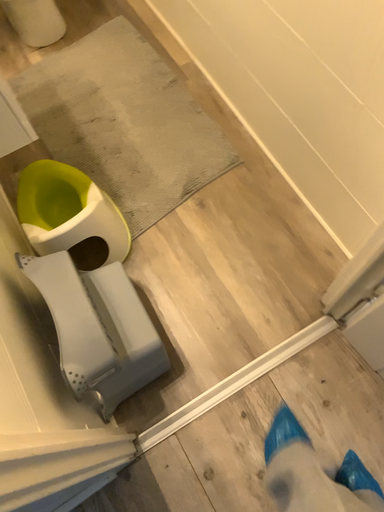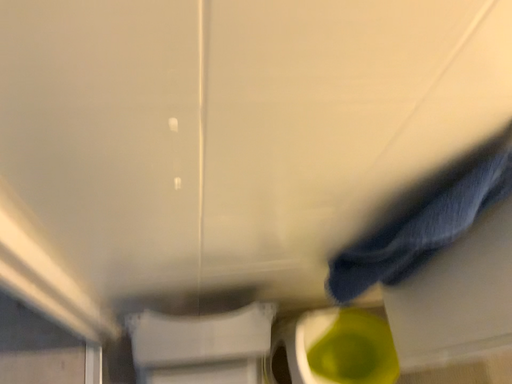
Question: Which way did the camera rotate in the video?

Choices:
 (A) rotated right
 (B) rotated left

Answer: (B)